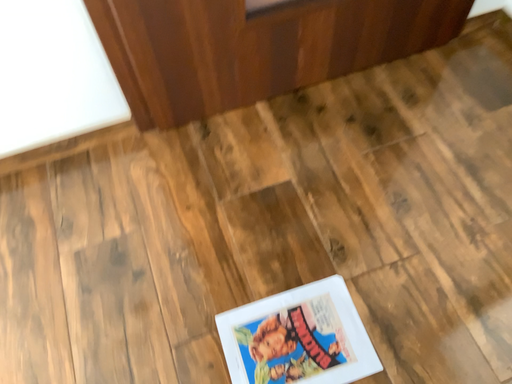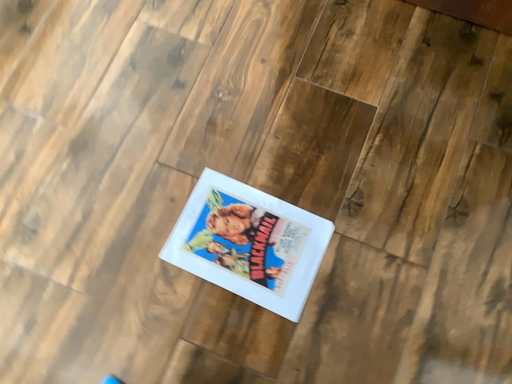
Question: How did the camera likely rotate when shooting the video?

Choices:
 (A) rotated right
 (B) rotated left

Answer: (B)